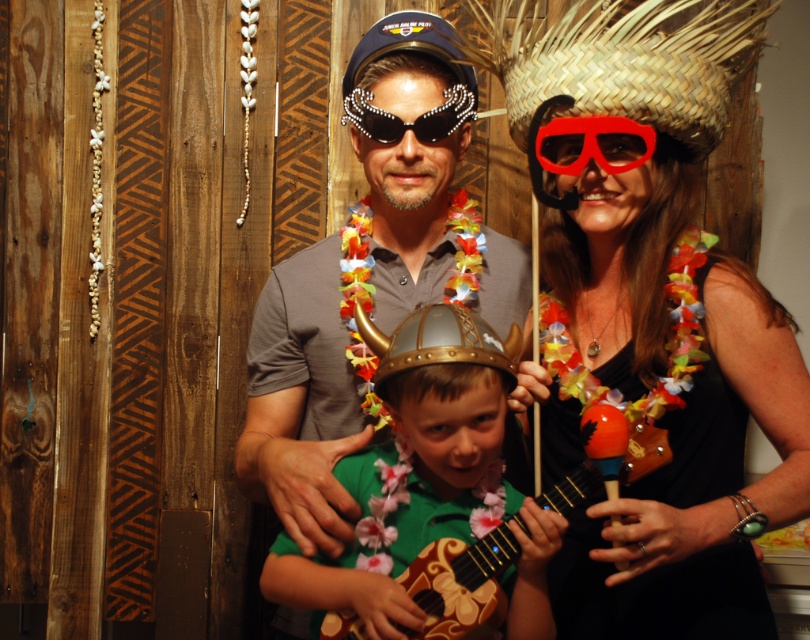
Is wooden maraca at right closer to the viewer compared to wooden acoustic guitar at center?

No, it is behind wooden acoustic guitar at center.

Is wooden maraca at right to the left of wooden acoustic guitar at center from the viewer's perspective?

In fact, wooden maraca at right is to the right of wooden acoustic guitar at center.

You are a GUI agent. You are given a task and a screenshot of the screen. Output one action in this format:
    pyautogui.click(x=<x>, y=<y>)
    Task: Click on the wooden maraca at right
    The image size is (810, 640).
    Given the screenshot: What is the action you would take?
    pyautogui.click(x=653, y=388)

Does matte black ukulele at center have a greater width compared to wooden acoustic guitar at center?

No, matte black ukulele at center is not wider than wooden acoustic guitar at center.

Does matte black ukulele at center appear on the left side of wooden acoustic guitar at center?

No, matte black ukulele at center is not to the left of wooden acoustic guitar at center.

Between point (762, 497) and point (425, 598), which one is positioned in front?

Point (425, 598) is more forward.

Locate an element on the screen. This screenshot has height=640, width=810. matte black ukulele at center is located at coordinates (625, 172).

Can you confirm if metallic green guitar at center is smaller than wooden acoustic guitar at center?

No, metallic green guitar at center is not smaller than wooden acoustic guitar at center.

This screenshot has height=640, width=810. What do you see at coordinates (427, 477) in the screenshot?
I see `metallic green guitar at center` at bounding box center [427, 477].

Locate an element on the screen. metallic green guitar at center is located at coordinates (427, 477).